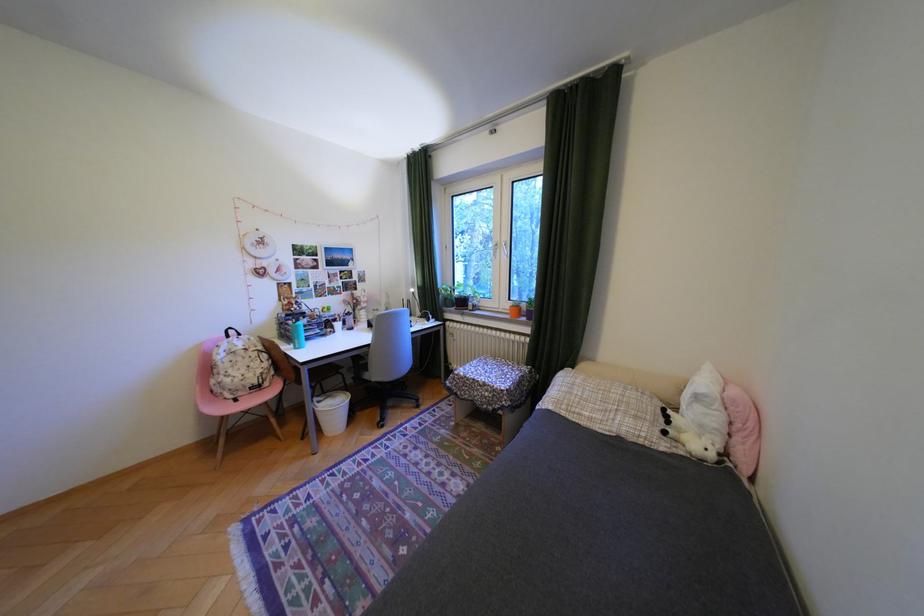
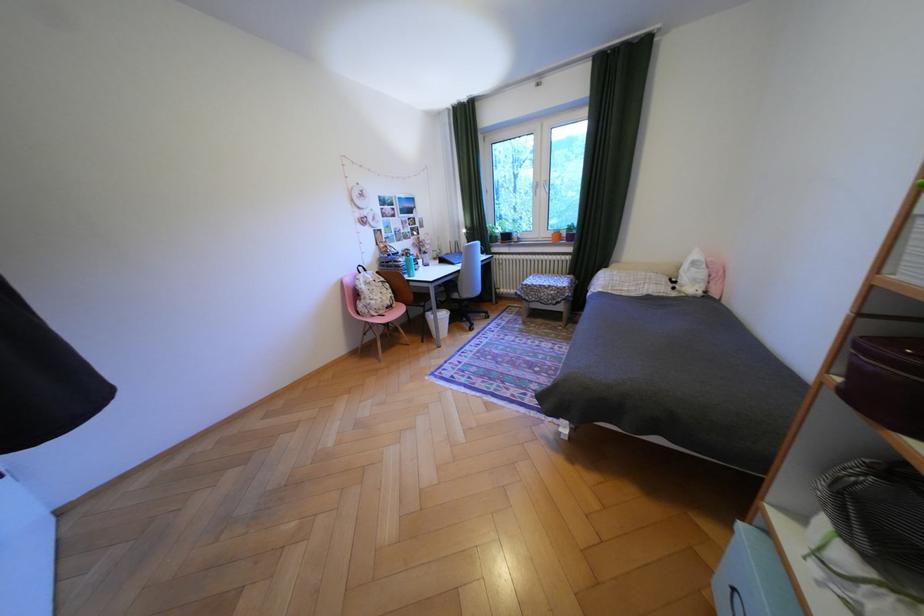
The point at [251,394] is marked in the first image. Where is the corresponding point in the second image?

(393, 312)